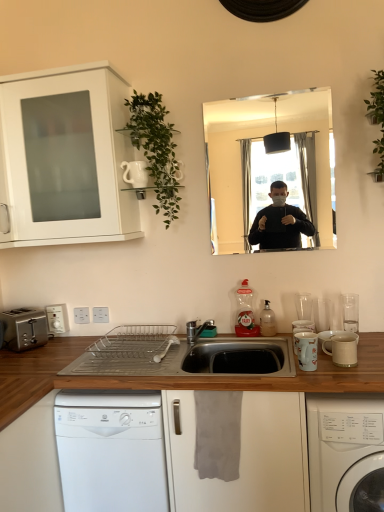
Identify the location of vacant point to the left of white glossy mug at right, the 2th appliance positioned from the left. (268, 378).